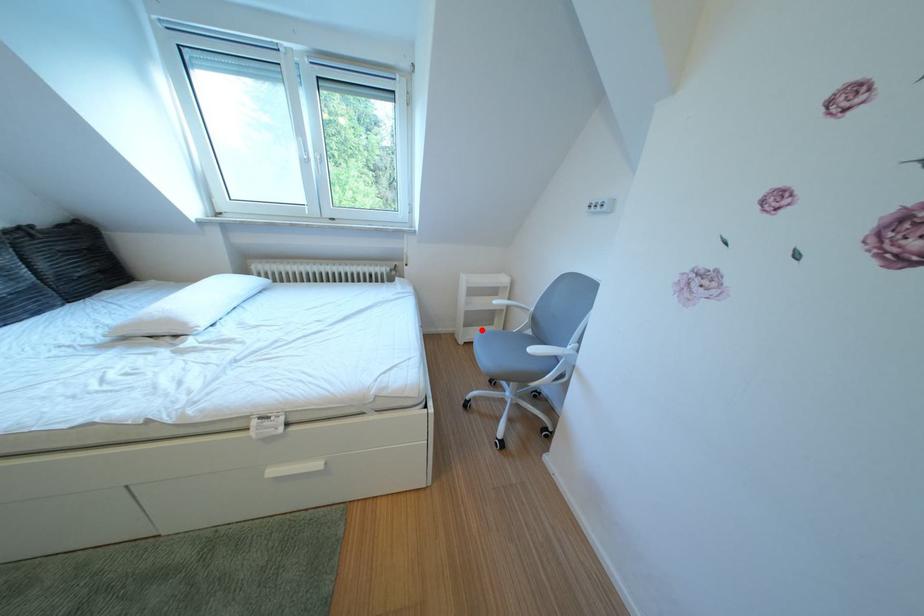
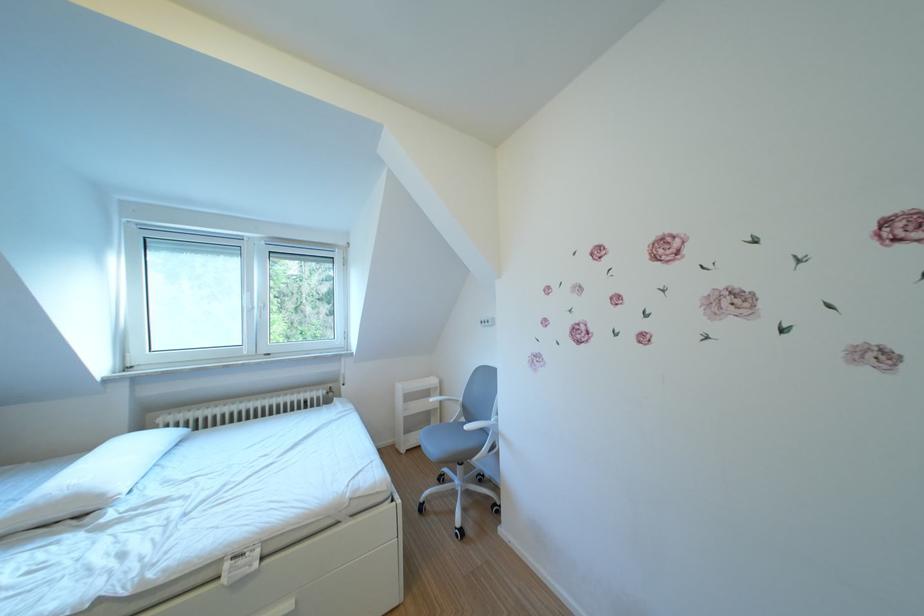
Locate, in the second image, the point that corresponds to the highlighted location in the first image.

(420, 437)